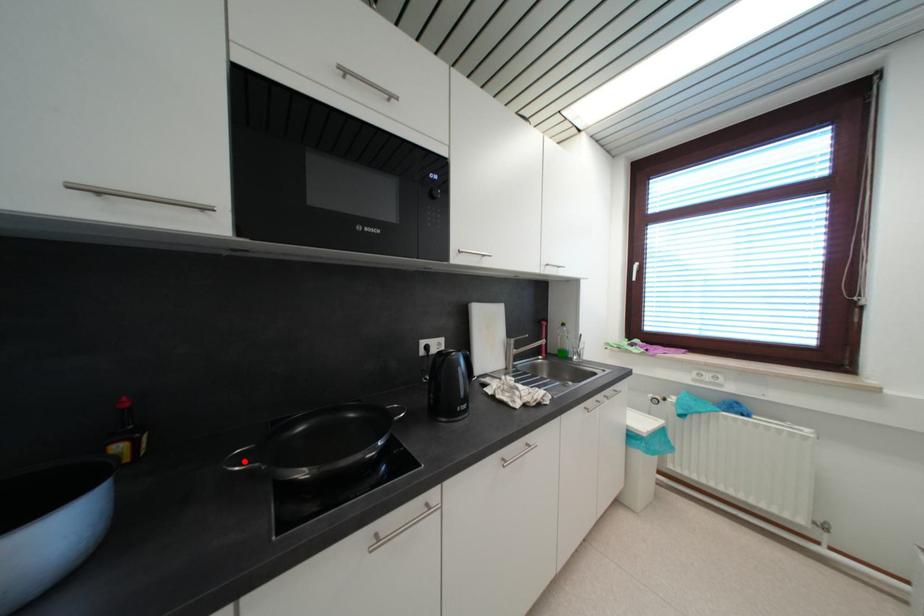
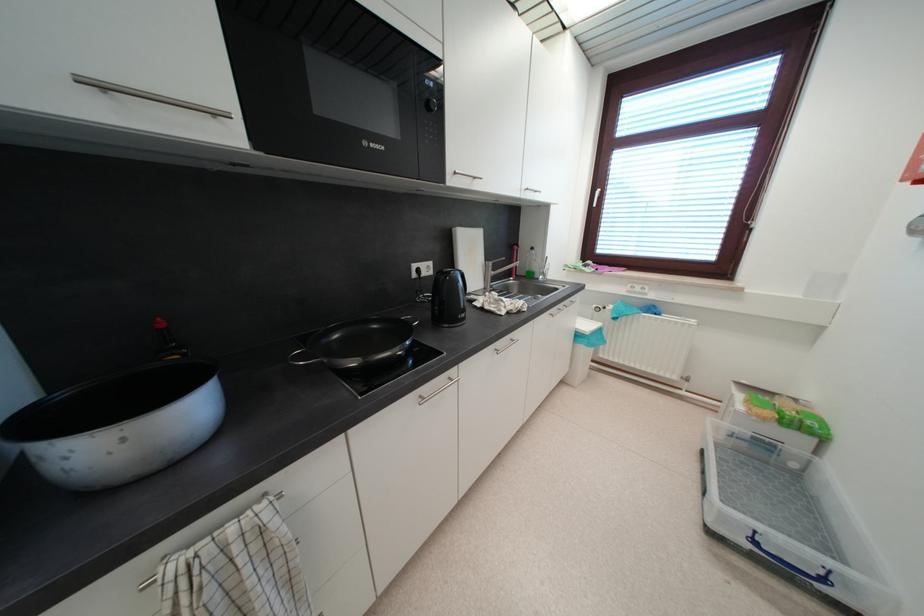
Where in the second image is the point corresponding to the highlighted location from the first image?

(304, 361)